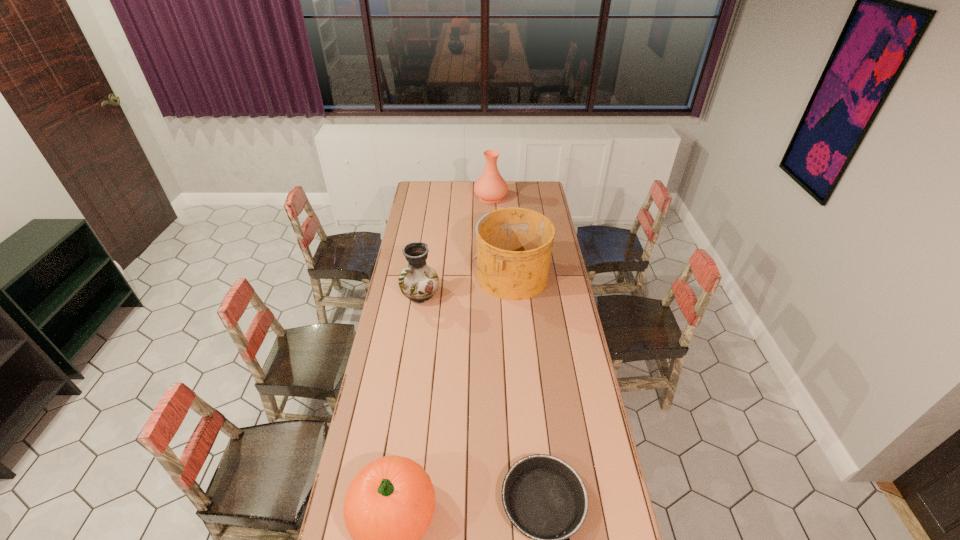
What are the coordinates of `vacant space at the far edge of the desktop` in the screenshot? It's located at (520, 187).

In the image, there is a desktop. At what (x,y) coordinates should I click in order to perform the action: click on blank space at the left edge. Please return your answer as a coordinate pair (x, y). This screenshot has height=540, width=960. Looking at the image, I should click on (417, 305).

Find the location of `vacant space at the right edge of the desktop`. vacant space at the right edge of the desktop is located at coordinates (560, 281).

In order to click on vacant space at the far left corner in this screenshot , I will do 415,198.

The height and width of the screenshot is (540, 960). Find the location of `free space between the bucket and the nearer vase`. free space between the bucket and the nearer vase is located at coordinates (466, 285).

Locate an element on the screen. free area in between the left vase and the bucket is located at coordinates (466, 285).

This screenshot has height=540, width=960. I want to click on the closest object to the shortest object, so click(x=389, y=505).

Point out which object is positioned as the second nearest to the farthest object. Please provide its 2D coordinates. Your answer should be formatted as a tuple, i.e. [(x, y)], where the tuple contains the x and y coordinates of a point satisfying the conditions above.

[(419, 282)]